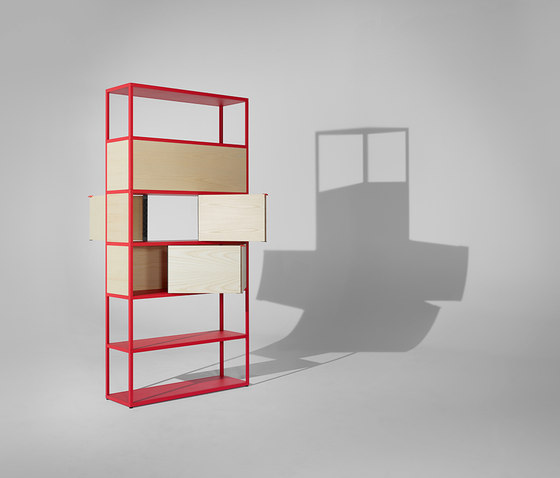
The height and width of the screenshot is (478, 560). I want to click on wooden space on shelves, so click(x=217, y=224), click(x=197, y=264), click(x=147, y=266), click(x=116, y=267), click(x=116, y=224), click(x=91, y=215), click(x=137, y=219), click(x=121, y=174), click(x=177, y=172).